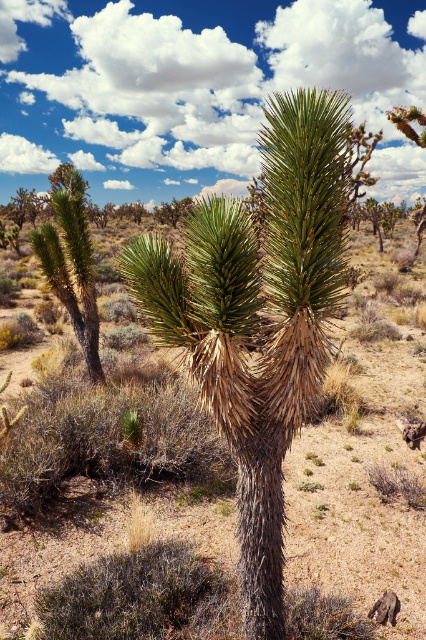
Who is shorter, white fluffy cloud at upper center or green spiky plant at center?

green spiky plant at center

Which is in front, point (350, 76) or point (219, 208)?

Positioned in front is point (219, 208).

Identify the location of white fluffy cloud at upper center. (195, 88).

Between white fluffy cloud at upper center and green spiky plant at left, which one is positioned lower?

Positioned lower is green spiky plant at left.

I want to click on white fluffy cloud at upper center, so click(195, 88).

Is point (302, 296) positioned in front of point (40, 230)?

Yes, it is.

Which is above, green spiky plant at center or green spiky plant at left?

green spiky plant at left is above.

The width and height of the screenshot is (426, 640). Find the location of `green spiky plant at center`. green spiky plant at center is located at coordinates (256, 321).